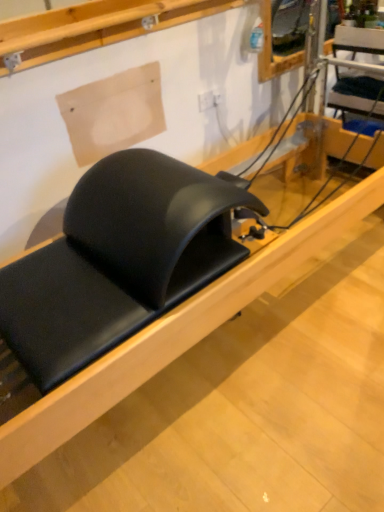
Identify the location of black leather bench at center. The width and height of the screenshot is (384, 512). (172, 335).

This screenshot has width=384, height=512. What do you see at coordinates (172, 335) in the screenshot? I see `black leather bench at center` at bounding box center [172, 335].

I want to click on black leather bench at center, so click(x=172, y=335).